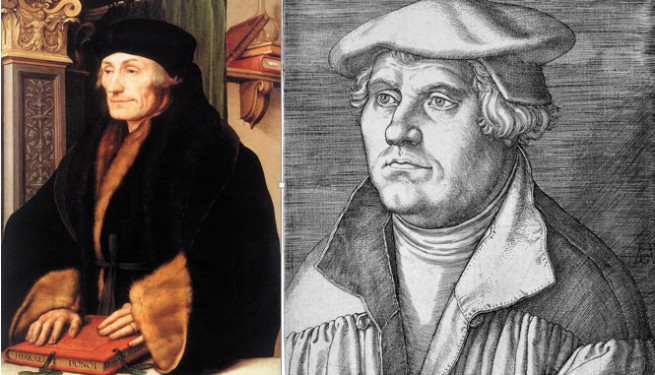
Where is `wall`? The height and width of the screenshot is (375, 655). wall is located at coordinates (316, 162).